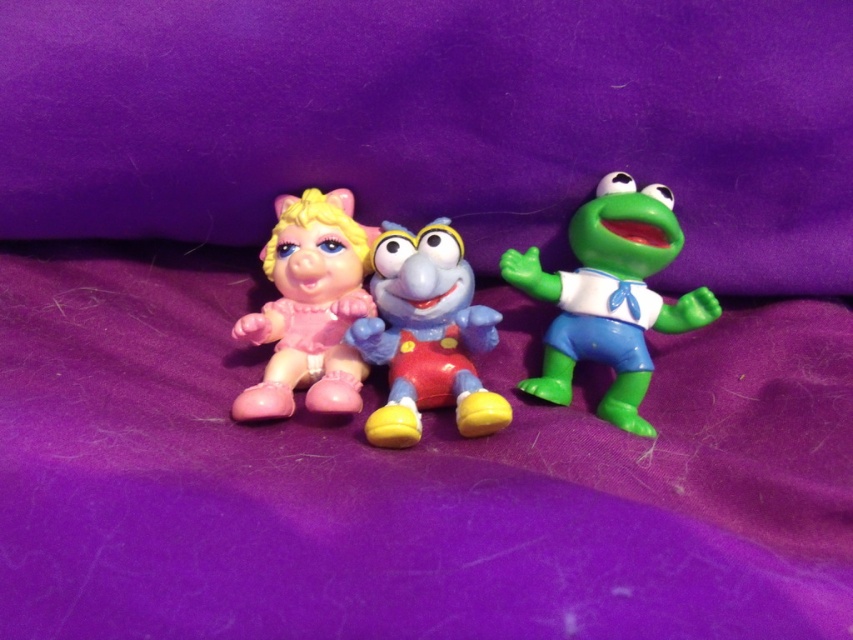
Is point (430, 392) closer to camera compared to point (250, 324)?

That is True.

Does plastic blue elephant at center have a lesser height compared to matte plastic piglet at left?

Yes.

Locate an element on the screen. The width and height of the screenshot is (853, 640). plastic blue elephant at center is located at coordinates (426, 336).

Between green plastic frog at right and plastic blue elephant at center, which one has more height?

With more height is green plastic frog at right.

Based on the photo, does green plastic frog at right appear over plastic blue elephant at center?

Correct, green plastic frog at right is located above plastic blue elephant at center.

Is point (534, 253) positioned after point (445, 358)?

Yes, it is.

The image size is (853, 640). I want to click on green plastic frog at right, so click(x=610, y=296).

At what (x,y) coordinates should I click in order to perform the action: click on green plastic frog at right. Please return your answer as a coordinate pair (x, y). Looking at the image, I should click on (610, 296).

Which is more to the left, green plastic frog at right or matte plastic piglet at left?

Positioned to the left is matte plastic piglet at left.

Which is behind, point (645, 429) or point (299, 298)?

Positioned behind is point (299, 298).

Locate an element on the screen. The width and height of the screenshot is (853, 640). green plastic frog at right is located at coordinates (610, 296).